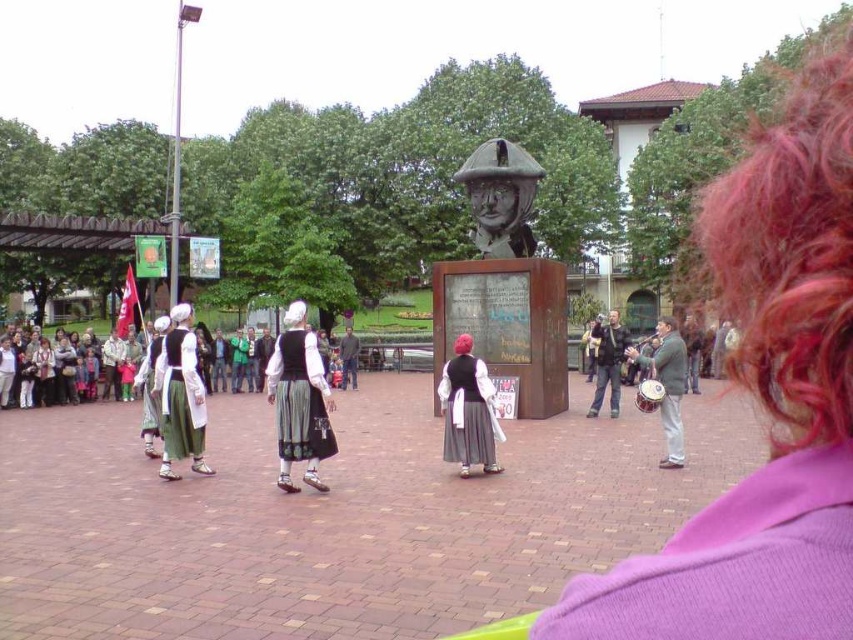
Is vivid pink hair at upper right wider than green fabric skirt at left?

Indeed, vivid pink hair at upper right has a greater width compared to green fabric skirt at left.

The image size is (853, 640). I want to click on vivid pink hair at upper right, so click(x=791, y=257).

Is vivid pink hair at upper right wider than green fabric drum at right?

Yes, vivid pink hair at upper right is wider than green fabric drum at right.

Describe the element at coordinates (791, 257) in the screenshot. Image resolution: width=853 pixels, height=640 pixels. I see `vivid pink hair at upper right` at that location.

Between point (770, 276) and point (675, 330), which one is positioned behind?

Positioned behind is point (675, 330).

Identify the location of vivid pink hair at upper right. (791, 257).

In the scene shown: Can you confirm if bronze statue at center is positioned to the right of dark gray fabric jacket at center?

Correct, you'll find bronze statue at center to the right of dark gray fabric jacket at center.

Does bronze statue at center appear on the left side of dark gray fabric jacket at center?

Incorrect, bronze statue at center is not on the left side of dark gray fabric jacket at center.

Is point (488, 250) closer to viewer compared to point (346, 344)?

Yes, point (488, 250) is in front of point (346, 344).

The width and height of the screenshot is (853, 640). I want to click on bronze statue at center, so click(x=500, y=196).